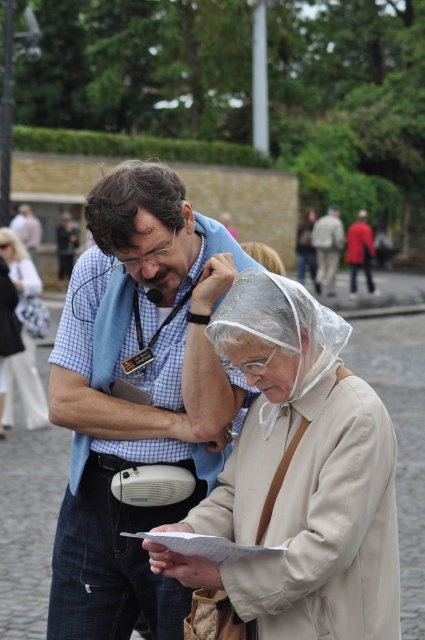
You are standing at point (255, 257) and want to walk to point (320, 284). Which direction should you move in relation to the two points?

You should move towards the point (320, 284), which is behind point (255, 257) from your current position.

You are a tailor observing the scene. You need to compare the size of the blue checkered shirt at center and the transparent plastic rain hat at upper center. Which one has a greater width?

The blue checkered shirt at center has a greater width than the transparent plastic rain hat at upper center according to the description.

You are a photographer positioned in the park. You need to capture a photo where both the red fabric jacket at center and the transparent plastic rain hat at upper center are clearly visible. Based on their positions, which object will appear closer to the camera in the final photo?

The red fabric jacket at center will appear closer to the camera because it is further to the viewer than the transparent plastic rain hat at upper center, meaning it is positioned nearer in the scene.